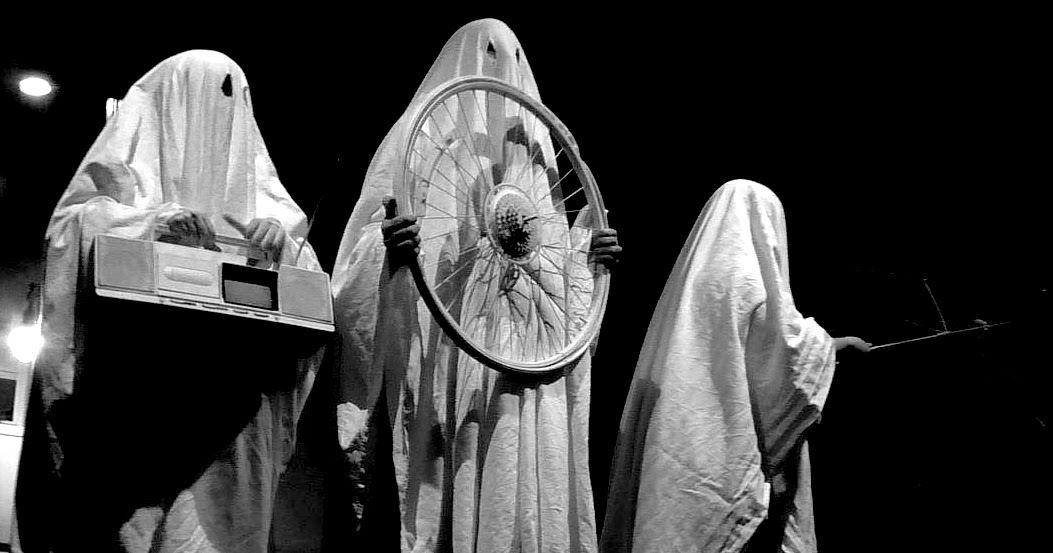
This screenshot has height=553, width=1053. Find the location of `light`. light is located at coordinates (28, 82).